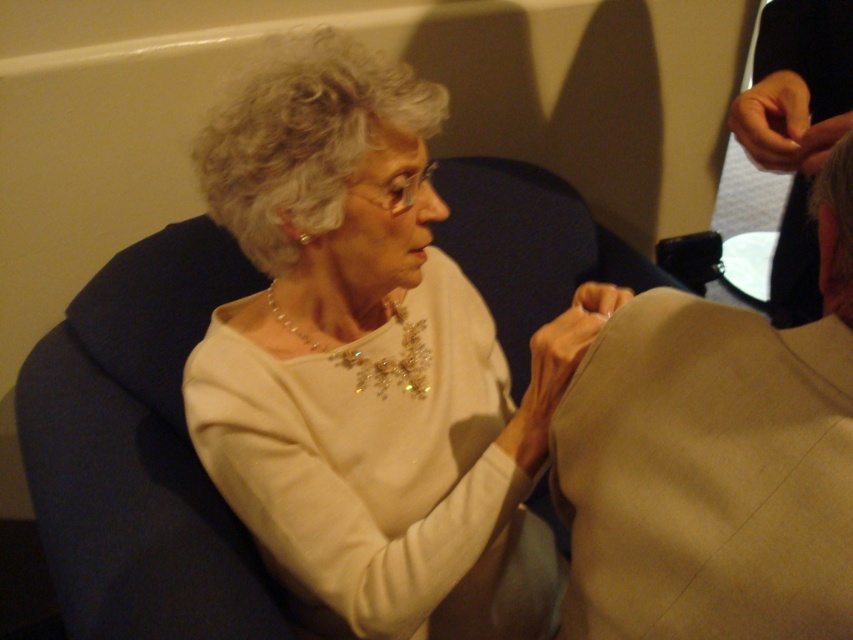
Is white satin blouse at center positioned at the back of tan fabric sleeve at upper right?

Yes, white satin blouse at center is further from the viewer.

Describe the element at coordinates (370, 365) in the screenshot. I see `white satin blouse at center` at that location.

This screenshot has height=640, width=853. What do you see at coordinates (370, 365) in the screenshot?
I see `white satin blouse at center` at bounding box center [370, 365].

Where is `white satin blouse at center`? This screenshot has height=640, width=853. white satin blouse at center is located at coordinates (370, 365).

Which is more to the left, white satin blouse at center or matte beige fabric at upper right?

From the viewer's perspective, white satin blouse at center appears more on the left side.

Is white satin blouse at center taller than matte beige fabric at upper right?

Yes.

Between point (548, 392) and point (798, 8), which one is positioned behind?

Point (798, 8)

This screenshot has width=853, height=640. Identify the location of white satin blouse at center. (370, 365).

Between tan fabric sleeve at upper right and matte beige fabric at upper right, which one has less height?

tan fabric sleeve at upper right is shorter.

Who is more distant from viewer, (757, 456) or (781, 252)?

Point (781, 252)

Where is `tan fabric sleeve at upper right`? The image size is (853, 640). tan fabric sleeve at upper right is located at coordinates (714, 461).